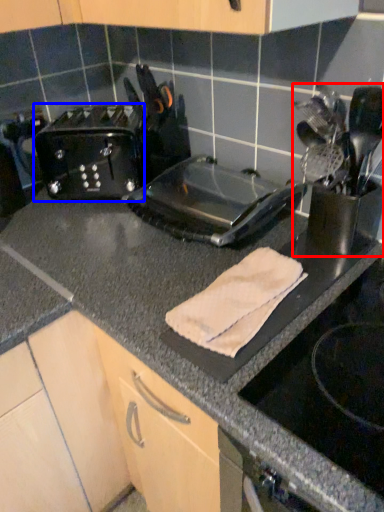
Question: Which object is further to the camera taking this photo, appliance (highlighted by a red box) or toaster (highlighted by a blue box)?

Choices:
 (A) appliance
 (B) toaster

Answer: (B)